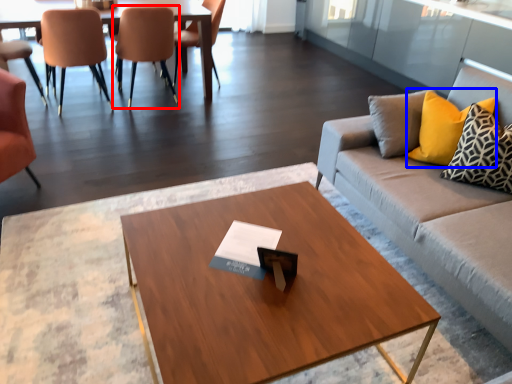
Question: Which object is further to the camera taking this photo, chair (highlighted by a red box) or pillow (highlighted by a blue box)?

Choices:
 (A) chair
 (B) pillow

Answer: (A)